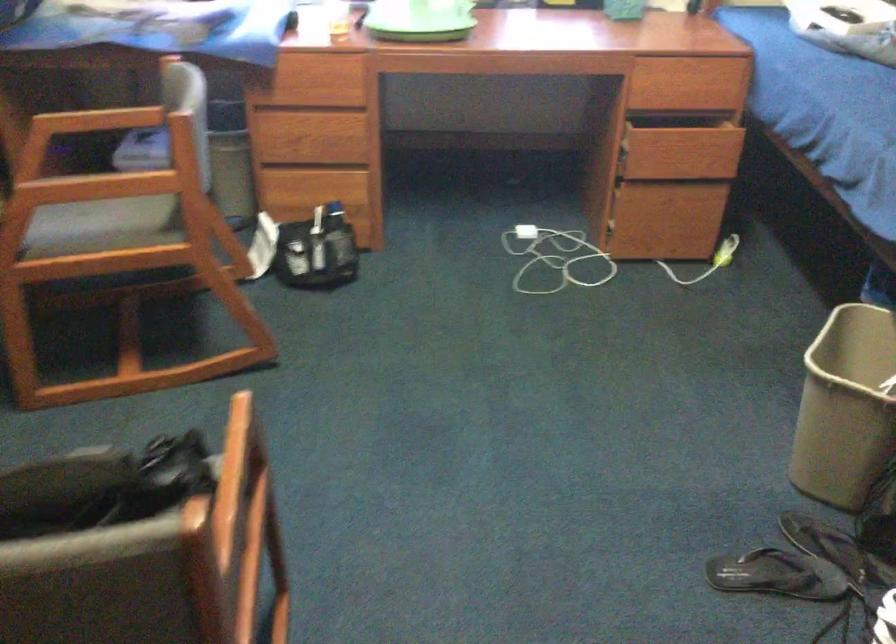
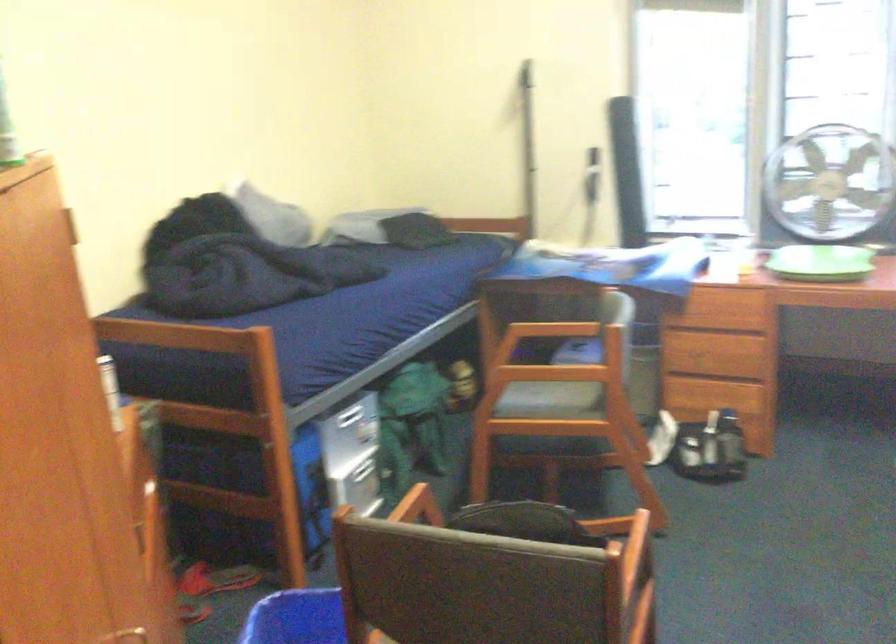
Locate, in the second image, the point that corresponds to pixel 98 191 in the first image.

(540, 375)